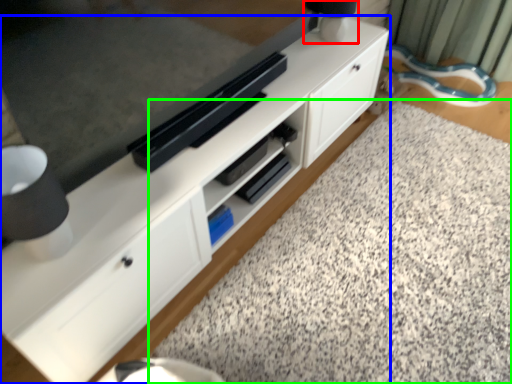
Question: Considering the real-world distances, which object is closest to table lamp (highlighted by a red box)? cabinetry (highlighted by a blue box) or granite (highlighted by a green box).

Choices:
 (A) cabinetry
 (B) granite

Answer: (A)